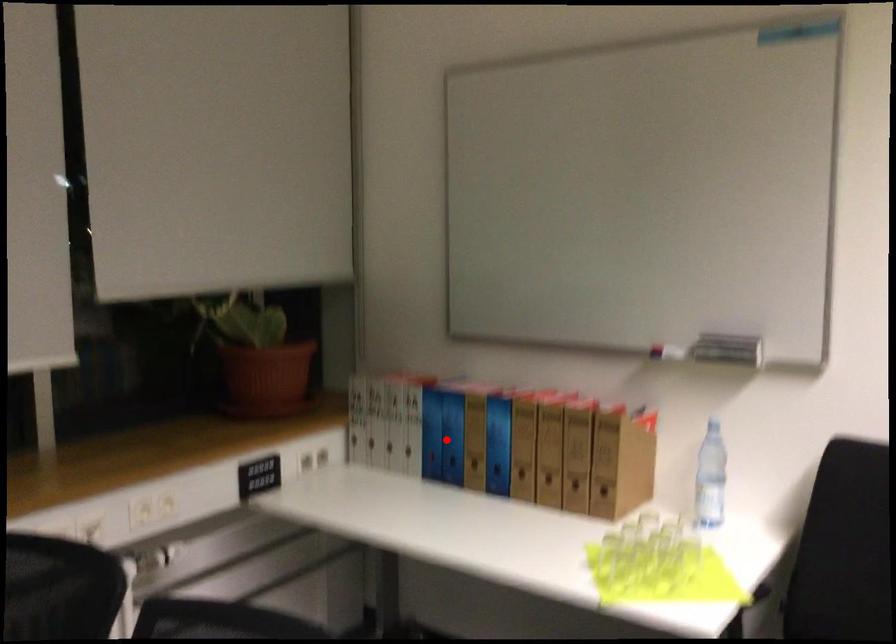
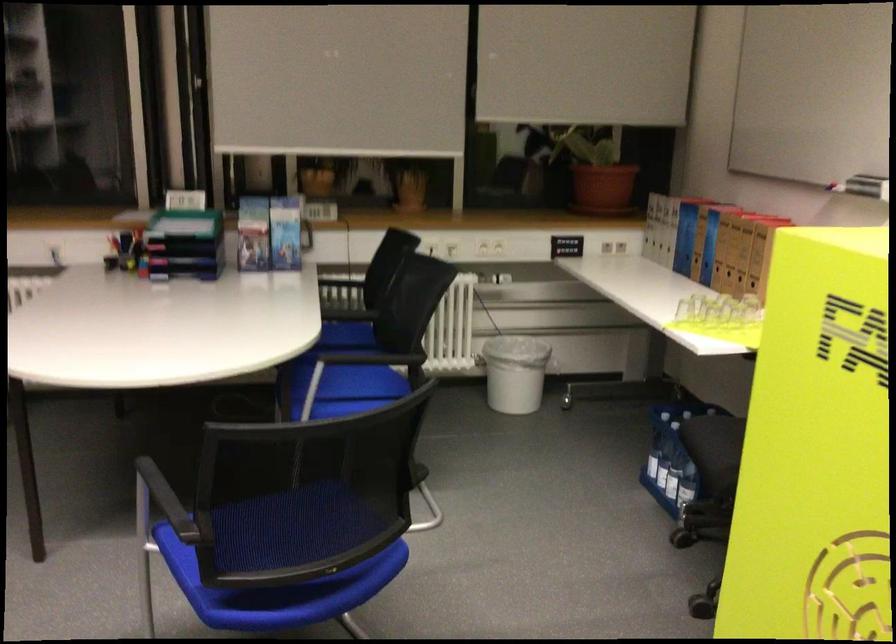
Question: I am providing you with two images of the same scene from different viewpoints. In image1, a red point is highlighted. Considering the same 3D point in image2, which of the following is correct?

Choices:
 (A) It is closer
 (B) It is farther

Answer: (B)